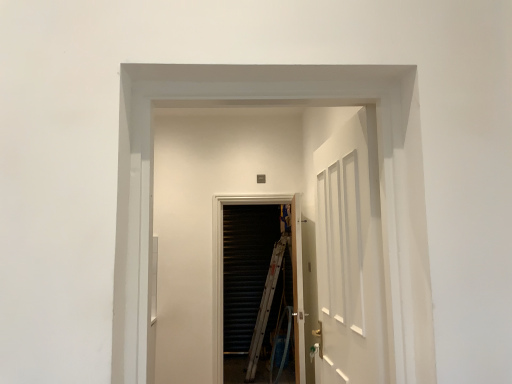
Question: Based on their positions, is white glossy elevator at center located to the left or right of black metal screen door at center?

Choices:
 (A) right
 (B) left

Answer: (A)

Question: Is point (164, 370) closer or farther from the camera than point (294, 296)?

Choices:
 (A) closer
 (B) farther

Answer: (B)

Question: Estimate the real-world distances between objects in this image. Which object is farther from the white wooden door at center?

Choices:
 (A) white glossy elevator at center
 (B) black metal screen door at center

Answer: (B)

Question: Which object is positioned farthest from the black metal screen door at center?

Choices:
 (A) white wooden door at center
 (B) white glossy elevator at center

Answer: (A)